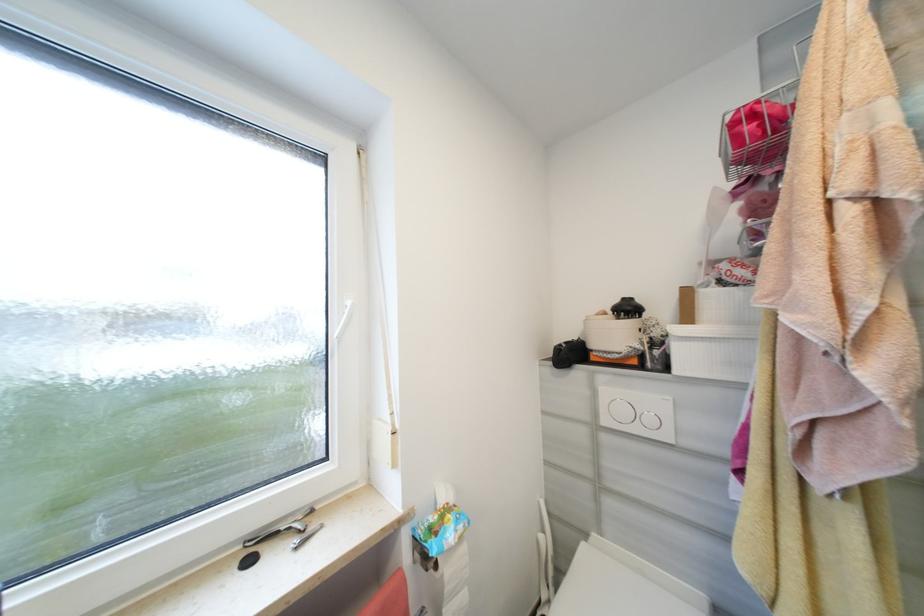
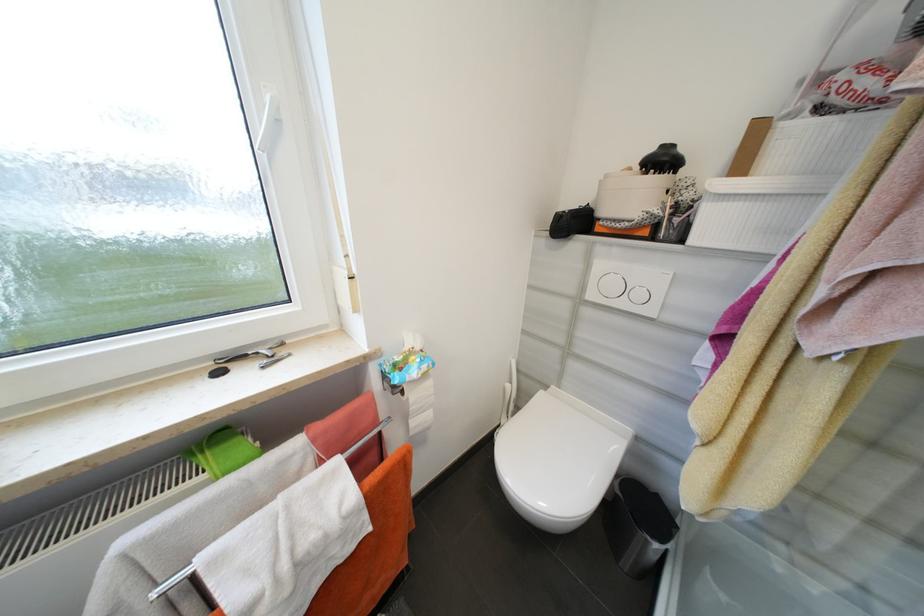
The point at (672,371) is marked in the first image. Where is the corresponding point in the second image?

(687, 241)